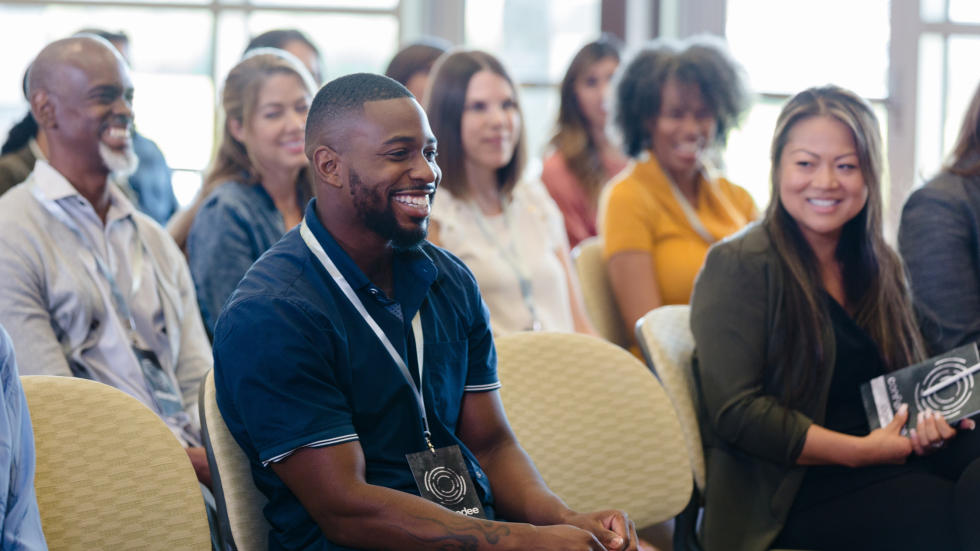
Where is `chairs`? The width and height of the screenshot is (980, 551). chairs is located at coordinates (187, 494), (219, 472), (554, 391), (655, 337), (596, 289).